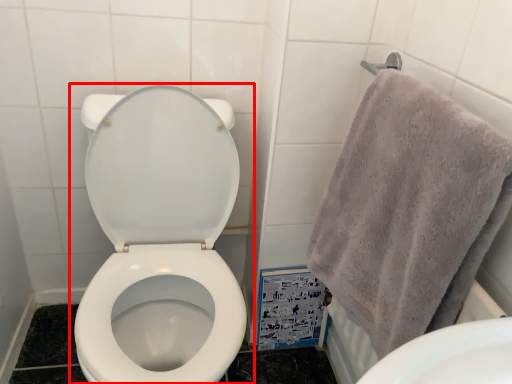
Question: From the image's perspective, what is the correct spatial relationship of toilet (annotated by the red box) in relation to towel?

Choices:
 (A) below
 (B) above

Answer: (A)